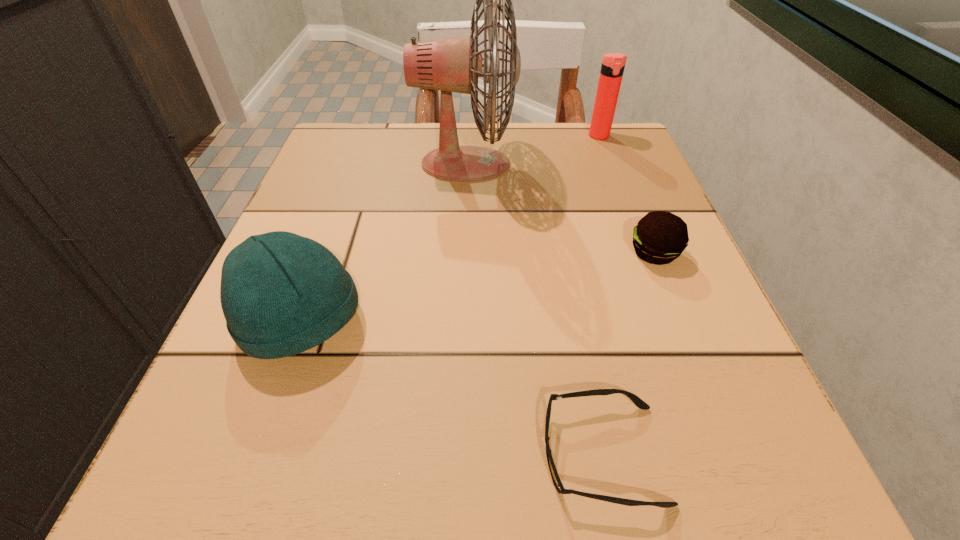
You are a GUI agent. You are given a task and a screenshot of the screen. Output one action in this format:
    pyautogui.click(x=<x>, y=<y>)
    Task: Click on the patty located in the right edge section of the desktop
    
    Given the screenshot: What is the action you would take?
    pyautogui.click(x=660, y=237)

This screenshot has width=960, height=540. Find the location of `spectacles that is at the right edge`. spectacles that is at the right edge is located at coordinates (635, 399).

Where is `object that is at the far right corner`? object that is at the far right corner is located at coordinates (613, 64).

You are a GUI agent. You are given a task and a screenshot of the screen. Output one action in this format:
    pyautogui.click(x=<x>, y=<y>)
    Task: Click on the object that is at the near right corner
    
    Given the screenshot: What is the action you would take?
    pyautogui.click(x=635, y=399)

Image resolution: width=960 pixels, height=540 pixels. Identify the location of vacant space at the far edge. (551, 139).

The image size is (960, 540). What are the coordinates of `vacant space at the left edge of the desktop` in the screenshot? It's located at (225, 366).

Locate an element on the screen. The width and height of the screenshot is (960, 540). vacant region at the right edge of the desktop is located at coordinates (611, 336).

Locate an element on the screen. This screenshot has width=960, height=540. vacant area at the far left corner of the desktop is located at coordinates (310, 170).

Identify the location of vacant space at the far right corner. (634, 140).

Where is `vacant area at the near right corner`? This screenshot has height=540, width=960. vacant area at the near right corner is located at coordinates (717, 494).